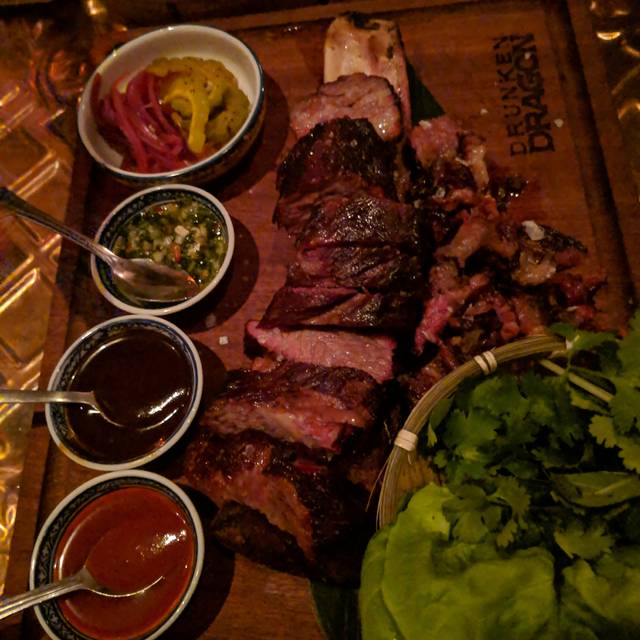
Where is `bowl`? This screenshot has height=640, width=640. bowl is located at coordinates pyautogui.click(x=436, y=387).